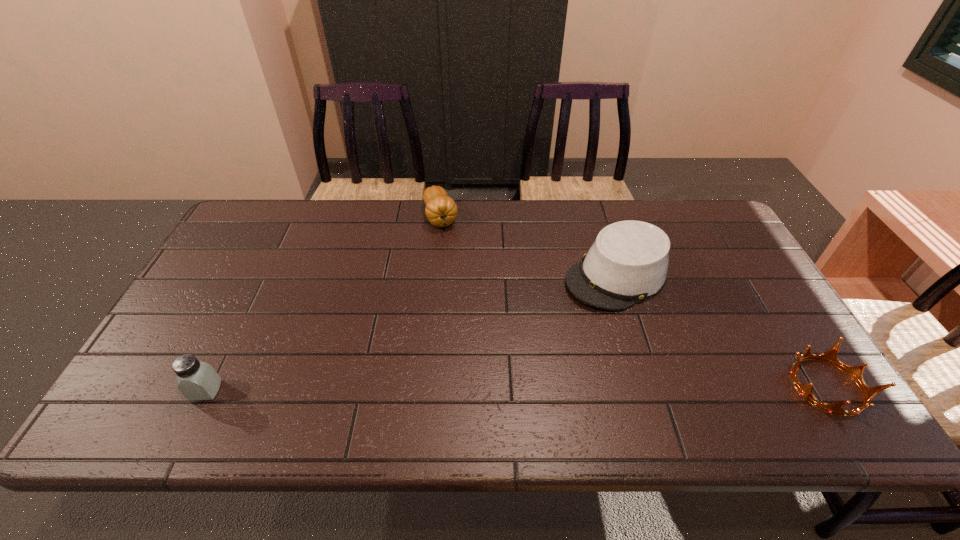
In order to click on free spot that satisfies the following two spatial constraints: 1. on the back side of the second farthest object; 2. on the right side of the leftmost object in this screenshot , I will do `click(262, 276)`.

Where is `vacant region that satisfies the following two spatial constraints: 1. on the front side of the second object from left to right; 2. on the left side of the third object from left to right`? vacant region that satisfies the following two spatial constraints: 1. on the front side of the second object from left to right; 2. on the left side of the third object from left to right is located at coordinates (435, 276).